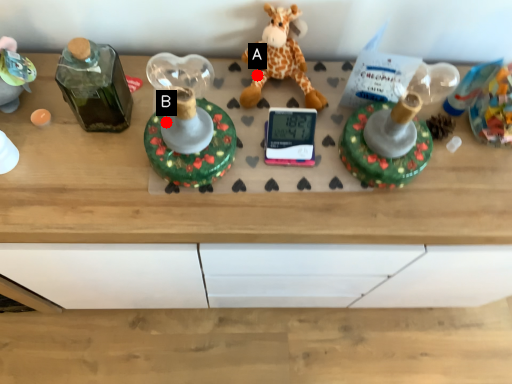
Question: Two points are circled on the image, labeled by A and B beside each circle. Which of the following is the farthest from the observer?

Choices:
 (A) A is further
 (B) B is further

Answer: (A)